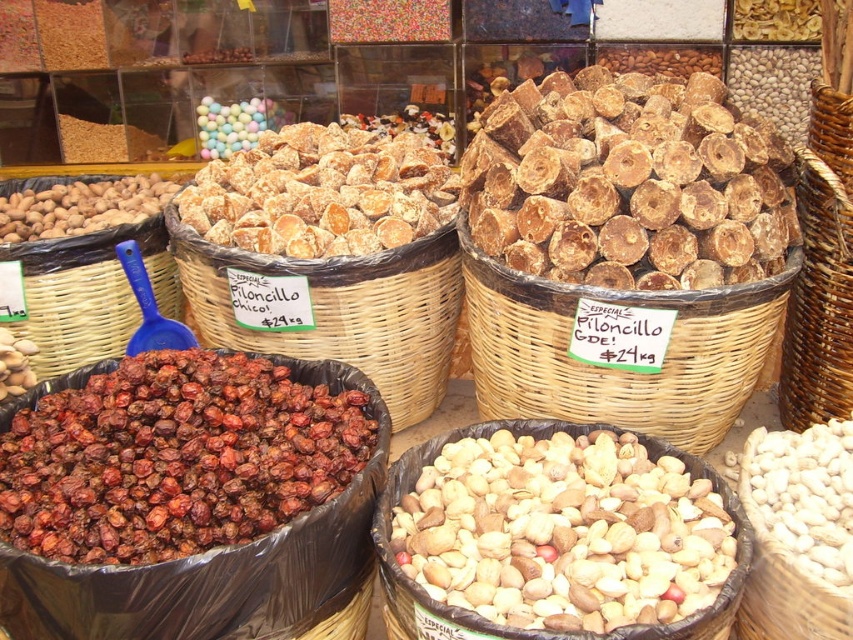
From the picture: Between brown rough wood at upper right and pastel glossy balls at upper center, which one has less height?

Standing shorter between the two is pastel glossy balls at upper center.

Which is in front, point (535, 268) or point (265, 115)?

Point (535, 268) is more forward.

This screenshot has width=853, height=640. I want to click on brown rough wood at upper right, so click(x=628, y=182).

Can you confirm if brown matte nuts at center is smaller than brown rough wood at upper right?

Yes.

Between brown matte nuts at center and brown rough wood at upper right, which one appears on the right side from the viewer's perspective?

Positioned to the right is brown rough wood at upper right.

The image size is (853, 640). What do you see at coordinates (556, 536) in the screenshot? I see `brown matte nuts at center` at bounding box center [556, 536].

The height and width of the screenshot is (640, 853). What are the coordinates of `brown matte nuts at center` in the screenshot? It's located at (556, 536).

Is brown matte nuts at center smaller than sugary brown cookies at center?

A: Yes.

Is brown matte nuts at center taller than sugary brown cookies at center?

In fact, brown matte nuts at center may be shorter than sugary brown cookies at center.

I want to click on brown matte nuts at center, so click(556, 536).